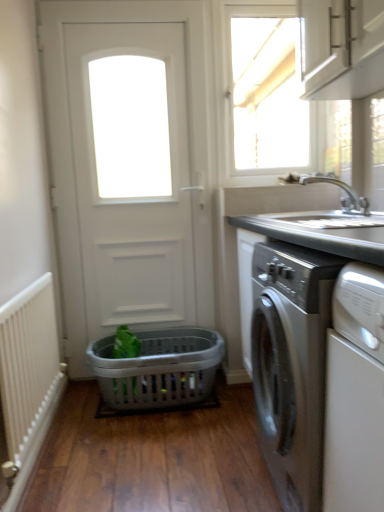
Question: From the image's perspective, is gray plastic laundry basket at center below white glossy window at upper center?

Choices:
 (A) no
 (B) yes

Answer: (B)

Question: Can you confirm if gray plastic laundry basket at center is taller than white glossy window at upper center?

Choices:
 (A) no
 (B) yes

Answer: (A)

Question: From the image's perspective, does gray plastic laundry basket at center appear higher than white glossy window at upper center?

Choices:
 (A) no
 (B) yes

Answer: (A)

Question: Considering the relative sizes of gray plastic laundry basket at center and white glossy window at upper center in the image provided, is gray plastic laundry basket at center shorter than white glossy window at upper center?

Choices:
 (A) no
 (B) yes

Answer: (B)

Question: Does gray plastic laundry basket at center lie in front of white glossy window at upper center?

Choices:
 (A) yes
 (B) no

Answer: (A)

Question: Can you confirm if gray plastic laundry basket at center is thinner than white glossy window at upper center?

Choices:
 (A) no
 (B) yes

Answer: (A)

Question: Does silver metallic faucet at upper right have a lesser height compared to white matte door at center?

Choices:
 (A) yes
 (B) no

Answer: (A)

Question: Can you confirm if silver metallic faucet at upper right is bigger than white matte door at center?

Choices:
 (A) yes
 (B) no

Answer: (B)

Question: Can you confirm if silver metallic faucet at upper right is positioned to the left of white matte door at center?

Choices:
 (A) yes
 (B) no

Answer: (B)

Question: Can you confirm if silver metallic faucet at upper right is wider than white matte door at center?

Choices:
 (A) no
 (B) yes

Answer: (B)

Question: Considering the relative sizes of silver metallic faucet at upper right and white matte door at center in the image provided, is silver metallic faucet at upper right thinner than white matte door at center?

Choices:
 (A) yes
 (B) no

Answer: (B)

Question: From a real-world perspective, does silver metallic faucet at upper right stand above white matte door at center?

Choices:
 (A) yes
 (B) no

Answer: (B)

Question: Is silver metallic faucet at upper right positioned in front of satin silver washing machine at right?

Choices:
 (A) no
 (B) yes

Answer: (A)